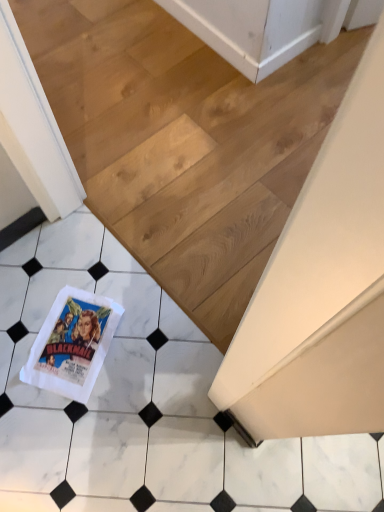
The width and height of the screenshot is (384, 512). Find the location of `vacant space to the right of white paper towel at lower left`. vacant space to the right of white paper towel at lower left is located at coordinates (149, 344).